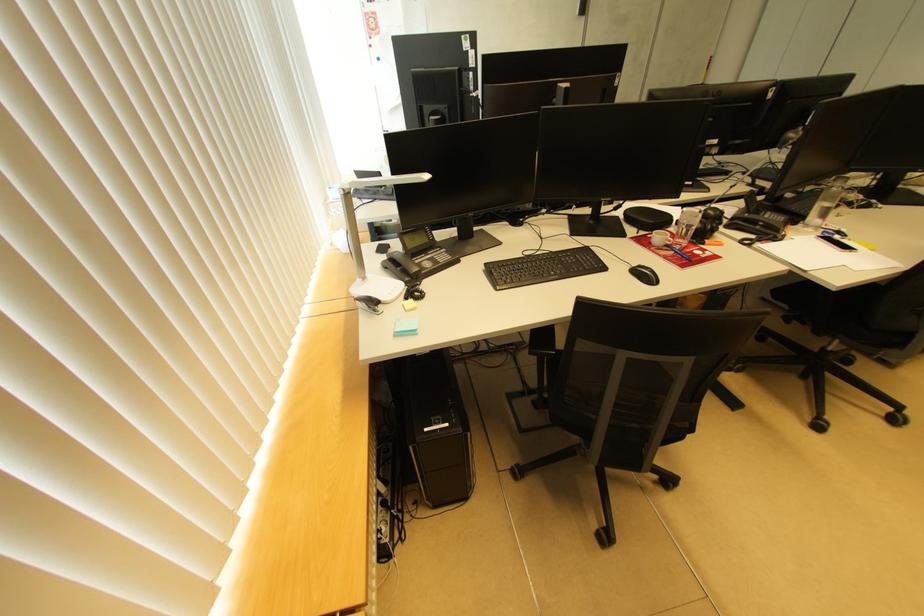
The location [798,231] corresponds to which object?

It refers to a orange highlighter.